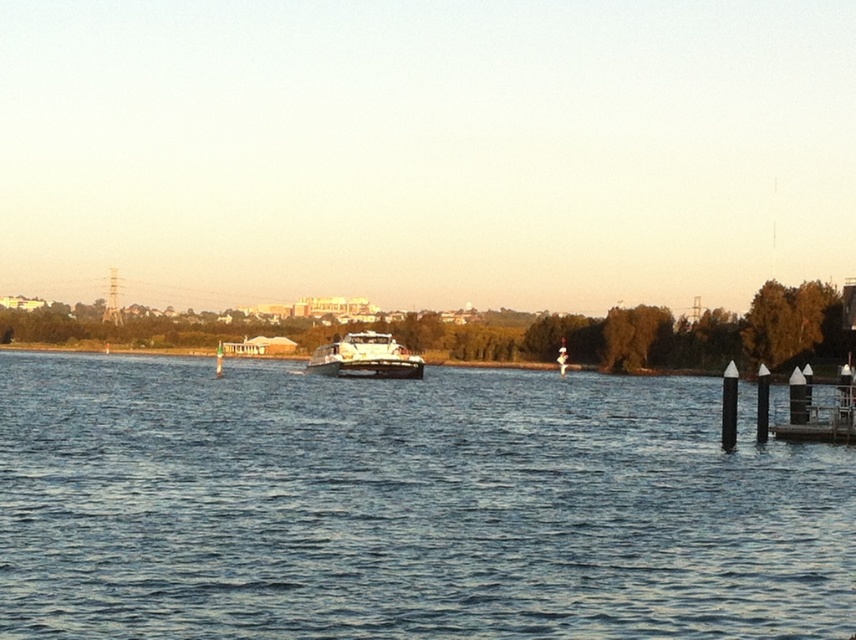
Question: Which point is farther from the camera taking this photo?

Choices:
 (A) (682, 634)
 (B) (367, 340)

Answer: (B)

Question: Is blue water at center wider than white glossy boat at center?

Choices:
 (A) yes
 (B) no

Answer: (A)

Question: Can you confirm if blue water at center is positioned to the left of white glossy boat at center?

Choices:
 (A) no
 (B) yes

Answer: (A)

Question: Does blue water at center have a smaller size compared to white glossy boat at center?

Choices:
 (A) yes
 (B) no

Answer: (B)